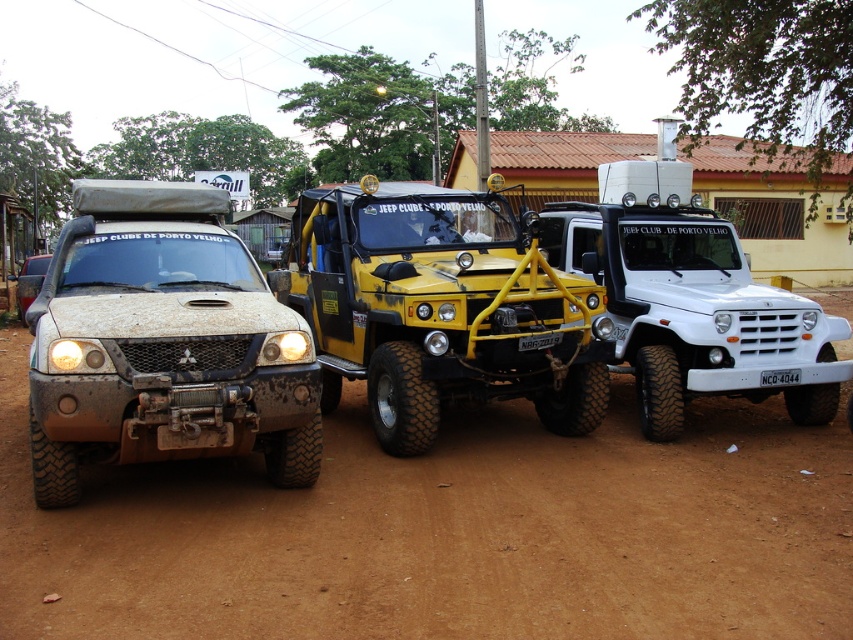
Question: Which object is closer to the camera taking this photo?

Choices:
 (A) dusty brown dirt at center
 (B) dusty matte truck at left
 (C) white matte jeep at center
 (D) yellow matte/soft jeep at center

Answer: (A)

Question: Can you confirm if yellow matte/soft jeep at center is bigger than white matte jeep at center?

Choices:
 (A) yes
 (B) no

Answer: (B)

Question: Does dusty brown dirt at center appear on the right side of white matte jeep at center?

Choices:
 (A) no
 (B) yes

Answer: (A)

Question: Is yellow matte/soft jeep at center closer to camera compared to white matte jeep at center?

Choices:
 (A) yes
 (B) no

Answer: (A)

Question: Estimate the real-world distances between objects in this image. Which object is farther from the yellow matte/soft jeep at center?

Choices:
 (A) dusty matte truck at left
 (B) white matte jeep at center

Answer: (A)

Question: Which point is closer to the camera taking this photo?

Choices:
 (A) (646, 188)
 (B) (525, 365)

Answer: (B)